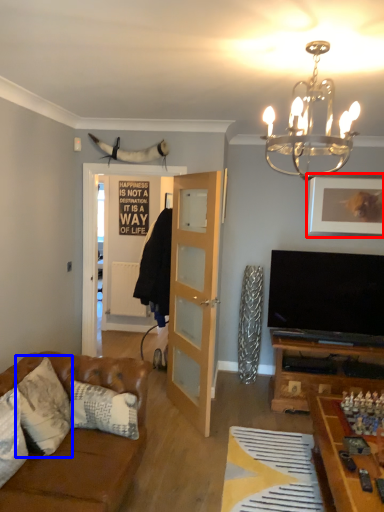
Question: Among these objects, which one is farthest to the camera, picture frame (highlighted by a red box) or pillow (highlighted by a blue box)?

Choices:
 (A) picture frame
 (B) pillow

Answer: (A)